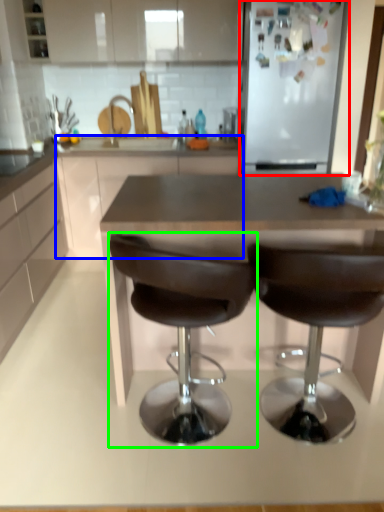
Question: Which is farther away from fridge (highlighted by a red box)? counter (highlighted by a blue box) or chair (highlighted by a green box)?

Choices:
 (A) counter
 (B) chair

Answer: (B)